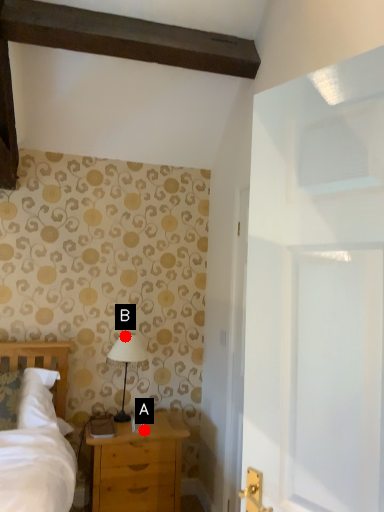
Question: Two points are circled on the image, labeled by A and B beside each circle. Among these points, which one is nearest to the camera?

Choices:
 (A) A is closer
 (B) B is closer

Answer: (A)